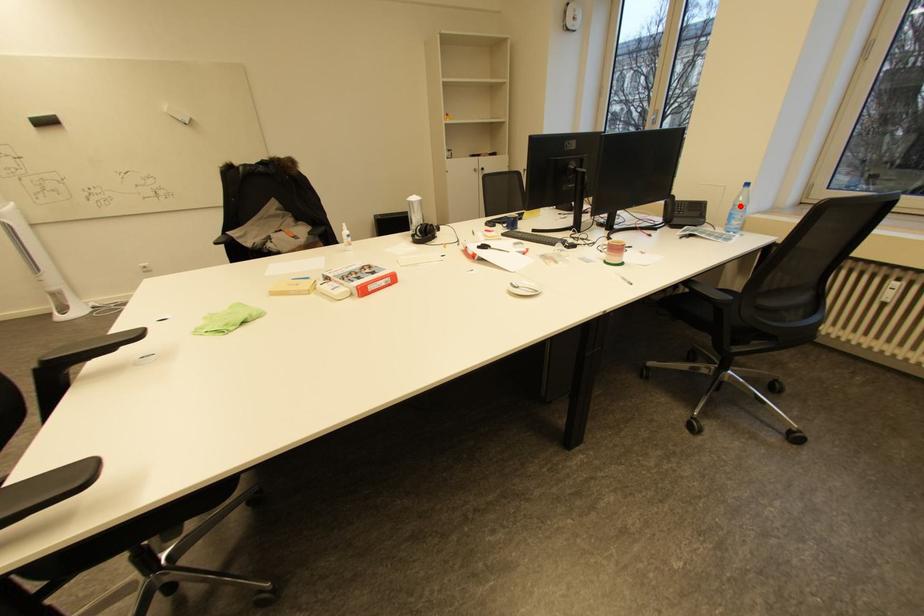
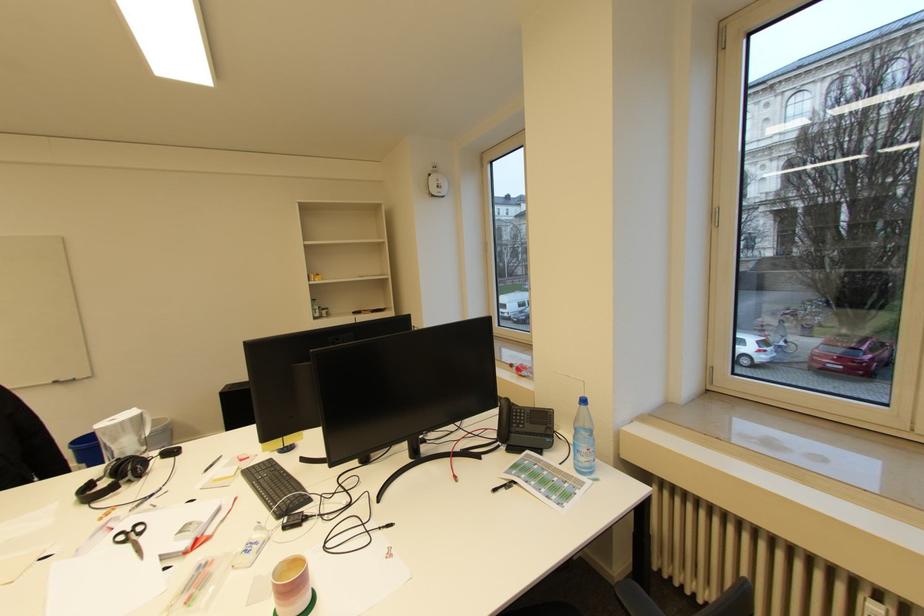
Locate, in the second image, the point that corresponds to the highlighted location in the first image.

(581, 429)